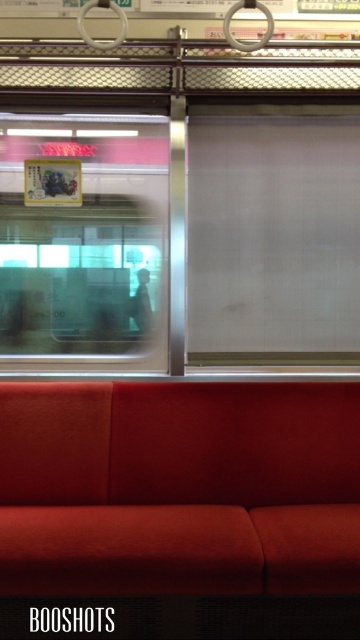
Who is higher up, transparent glass window at upper left or smooth black jacket at center?

transparent glass window at upper left is higher up.

Is point (101, 355) positioned behind point (140, 296)?

No, (101, 355) is closer to viewer.

What are the coordinates of `transparent glass window at upper left` in the screenshot? It's located at (83, 241).